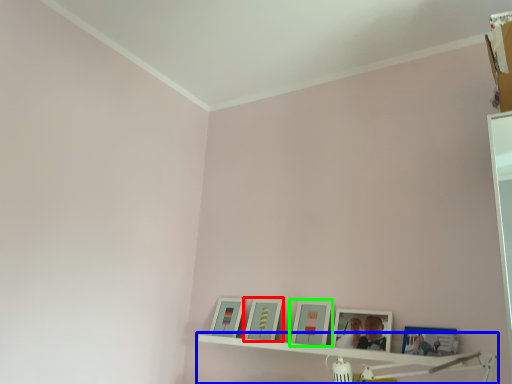
Question: Which object is the farthest from picture frame (highlighted by a red box)? Choose among these: shelf (highlighted by a blue box) or picture frame (highlighted by a green box).

Choices:
 (A) shelf
 (B) picture frame

Answer: (A)